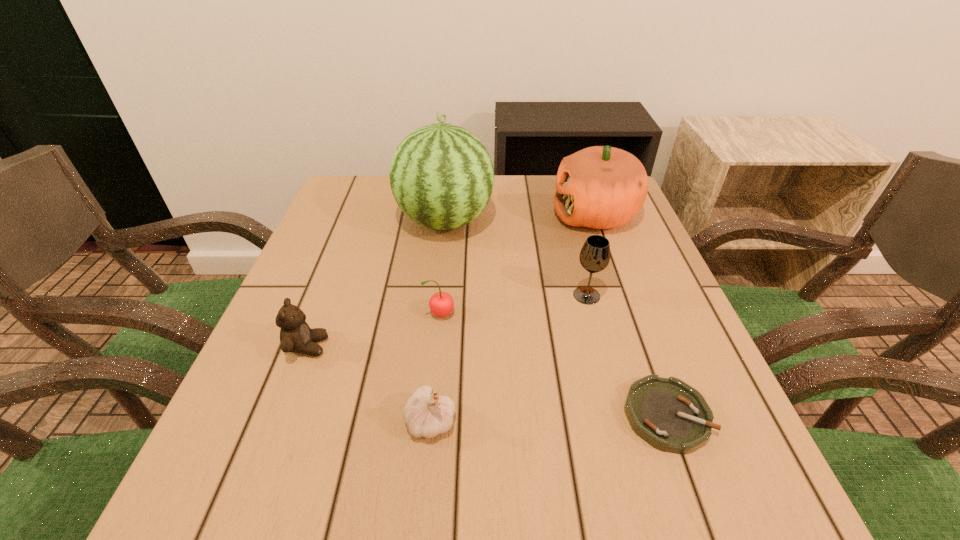
Find the location of a particular element. Image resolution: width=960 pixels, height=540 pixels. free space between the garlic and the wineglass is located at coordinates (509, 359).

This screenshot has height=540, width=960. In order to click on the sixth closest object to the fourth farthest object in this screenshot , I will do `click(601, 187)`.

Identify which object is located as the fifth nearest to the wineglass. Please provide its 2D coordinates. Your answer should be formatted as a tuple, i.e. [(x, y)], where the tuple contains the x and y coordinates of a point satisfying the conditions above.

[(425, 415)]

Identify the location of vacant position in the image that satisfies the following two spatial constraints: 1. on the face of the third nearest object; 2. on the right side of the garlic. The image size is (960, 540). (279, 421).

You are a GUI agent. You are given a task and a screenshot of the screen. Output one action in this format:
    pyautogui.click(x=<x>, y=<y>)
    Task: Click on the vacant space that satisfies the following two spatial constraints: 1. on the face of the leftmost object; 2. on the left side of the ashtray
    
    Given the screenshot: What is the action you would take?
    pyautogui.click(x=281, y=415)

Identify the location of free space that satisfies the following two spatial constraints: 1. on the face of the shortest object; 2. on the right side of the fifth farthest object. (281, 415).

Locate an element on the screen. This screenshot has height=540, width=960. free space that satisfies the following two spatial constraints: 1. on the front side of the third tallest object; 2. on the face of the teddy bear is located at coordinates (600, 347).

The height and width of the screenshot is (540, 960). I want to click on vacant space that satisfies the following two spatial constraints: 1. on the back side of the shortest object; 2. on the face of the leftmost object, so click(642, 347).